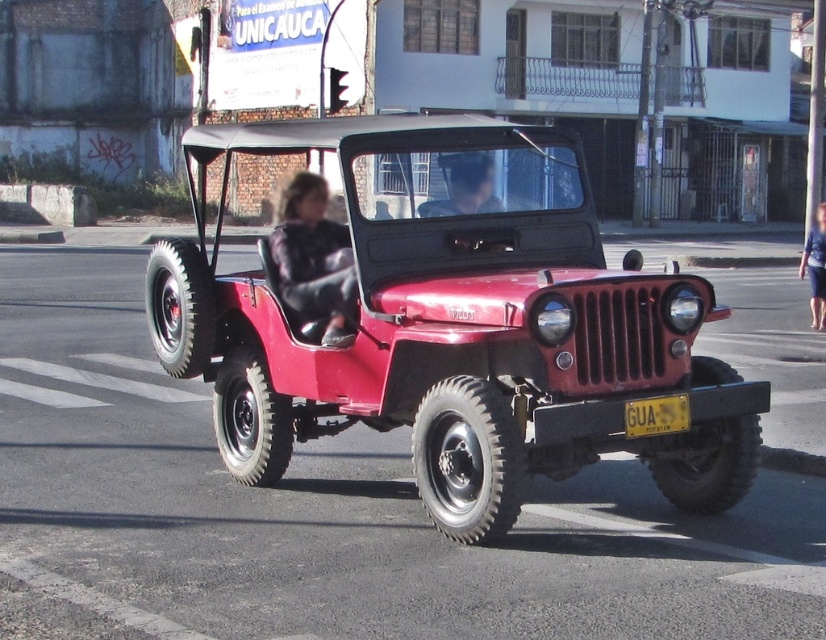
You are a pedestrian standing on the sidewalk. You see the shiny red jeep at center and the blue fabric skirt at right. Which object is closer to the left side of your view?

The shiny red jeep at center is to the left of the blue fabric skirt at right, so it is closer to the left side of your view.

You are a passenger in the vintage red Jeep Willys MB. You notice two items at the center of your view. One is the fuzzy black jacket at center and the other is the yellow metallic license plate at center. Which item appears larger in your field of view?

The fuzzy black jacket at center is taller than the yellow metallic license plate at center, so it appears larger in your field of view.

You are a passenger in the vintage red Jeep Willys MB and need to hand a map to someone wearing the fuzzy black jacket at center. The yellow metallic license plate at center is between you and the jacket. Can you reach the jacket without touching the license plate?

The fuzzy black jacket at center and yellow metallic license plate at center are 9.65 feet apart, so you can reach the jacket without touching the license plate since the distance is sufficient.